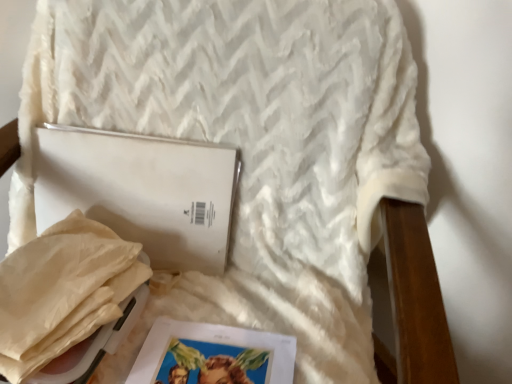
Question: Does beige paper bag at lower left contain white matte journal at center?

Choices:
 (A) yes
 (B) no

Answer: (B)

Question: From a real-world perspective, is beige paper bag at lower left located higher than white matte journal at center?

Choices:
 (A) no
 (B) yes

Answer: (A)

Question: Can you confirm if beige paper bag at lower left is shorter than white matte journal at center?

Choices:
 (A) no
 (B) yes

Answer: (B)

Question: Is beige paper bag at lower left thinner than white matte journal at center?

Choices:
 (A) no
 (B) yes

Answer: (A)

Question: Can you confirm if beige paper bag at lower left is bigger than white matte journal at center?

Choices:
 (A) yes
 (B) no

Answer: (B)

Question: From a real-world perspective, is matte paper magazine at lower center positioned above or below white matte journal at center?

Choices:
 (A) above
 (B) below

Answer: (B)

Question: Relative to white matte journal at center, is matte paper magazine at lower center in front or behind?

Choices:
 (A) front
 (B) behind

Answer: (A)

Question: Considering the positions of matte paper magazine at lower center and white matte journal at center in the image, is matte paper magazine at lower center bigger or smaller than white matte journal at center?

Choices:
 (A) big
 (B) small

Answer: (B)

Question: Is matte paper magazine at lower center taller or shorter than white matte journal at center?

Choices:
 (A) short
 (B) tall

Answer: (A)

Question: Would you say white matte journal at center is to the left or to the right of matte paper magazine at lower center in the picture?

Choices:
 (A) left
 (B) right

Answer: (A)

Question: From the image's perspective, is white matte journal at center positioned above or below matte paper magazine at lower center?

Choices:
 (A) above
 (B) below

Answer: (A)

Question: Is white matte journal at center in front of or behind matte paper magazine at lower center in the image?

Choices:
 (A) front
 (B) behind

Answer: (B)

Question: From a real-world perspective, relative to matte paper magazine at lower center, is white matte journal at center vertically above or below?

Choices:
 (A) above
 (B) below

Answer: (A)

Question: In the image, is beige paper bag at lower left on the left side or the right side of matte paper magazine at lower center?

Choices:
 (A) right
 (B) left

Answer: (B)

Question: Is beige paper bag at lower left inside the boundaries of matte paper magazine at lower center, or outside?

Choices:
 (A) outside
 (B) inside

Answer: (A)